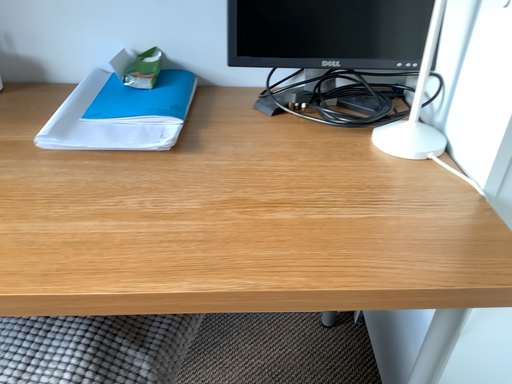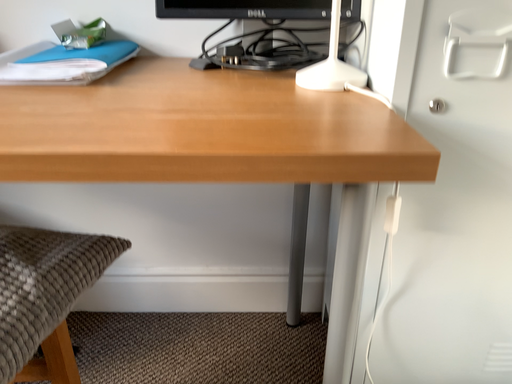
Question: How did the camera likely rotate when shooting the video?

Choices:
 (A) rotated upward
 (B) rotated downward

Answer: (A)